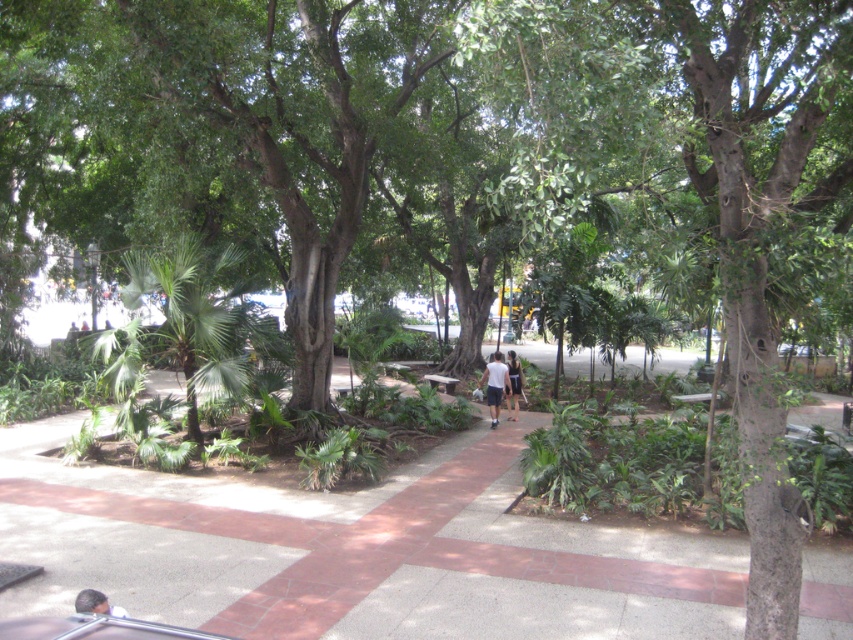
Question: Which point is farther to the camera?

Choices:
 (A) white fabric shorts at center
 (B) white cotton couple at center

Answer: (A)

Question: Observing the image, what is the correct spatial positioning of dark brown hair at lower left in reference to wooden park bench at center?

Choices:
 (A) above
 (B) below

Answer: (B)

Question: Which point is farther to the camera?

Choices:
 (A) [x=511, y=365]
 (B) [x=91, y=600]
 (C) [x=425, y=380]

Answer: (C)

Question: Is dark brown hair at lower left positioned at the back of white fabric shorts at center?

Choices:
 (A) no
 (B) yes

Answer: (A)

Question: Among these objects, which one is nearest to the camera?

Choices:
 (A) dark brown hair at lower left
 (B) white fabric shorts at center

Answer: (A)

Question: Is white cotton couple at center further to the viewer compared to wooden park bench at center?

Choices:
 (A) yes
 (B) no

Answer: (B)